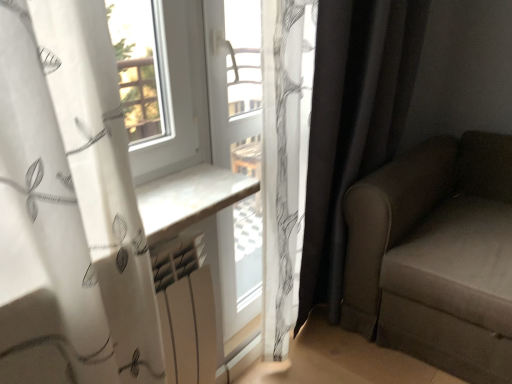
Find the location of a particular element. This screenshot has height=384, width=512. black fabric curtain at right is located at coordinates (352, 124).

In order to face white matte radiator at center, should I rotate leftwards or rightwards?

Rotate left and turn 10.207 degrees.

This screenshot has height=384, width=512. In order to click on suede-like brown couch at right in this screenshot , I will do `click(436, 256)`.

What do you see at coordinates (234, 83) in the screenshot?
I see `white plastic window frame at center` at bounding box center [234, 83].

The image size is (512, 384). In order to click on black fabric curtain at right in this screenshot , I will do `click(352, 124)`.

Consider the image. What's the angular difference between white plastic window frame at center and suede-like brown couch at right's facing directions?

The angular difference between white plastic window frame at center and suede-like brown couch at right is 90.3 degrees.

Who is bigger, white plastic window frame at center or suede-like brown couch at right?

suede-like brown couch at right is bigger.

Is white plastic window frame at center facing towards suede-like brown couch at right?

Yes, white plastic window frame at center is aimed at suede-like brown couch at right.

Is suede-like brown couch at right positioned before black fabric curtain at right?

Yes, suede-like brown couch at right is closer to the viewer.

From a real-world perspective, is suede-like brown couch at right positioned under black fabric curtain at right based on gravity?

Yes.

Who is smaller, suede-like brown couch at right or black fabric curtain at right?

With smaller size is black fabric curtain at right.

Which of these two, suede-like brown couch at right or black fabric curtain at right, is thinner?

Thinner between the two is black fabric curtain at right.

Can you confirm if white matte radiator at center is thinner than black fabric curtain at right?

Indeed, white matte radiator at center has a lesser width compared to black fabric curtain at right.

What are the coordinates of `radiator in front of the black fabric curtain at right` in the screenshot? It's located at (186, 309).

Does point (167, 278) come closer to viewer compared to point (400, 16)?

That is True.

From a real-world perspective, does white matte radiator at center sit lower than black fabric curtain at right?

Correct, in the physical world, white matte radiator at center is lower than black fabric curtain at right.

From the image's perspective, is suede-like brown couch at right located beneath white matte radiator at center?

Actually, suede-like brown couch at right appears above white matte radiator at center in the image.

This screenshot has width=512, height=384. What are the coordinates of `studio couch that appears on the right of white matte radiator at center` in the screenshot? It's located at (436, 256).

Does suede-like brown couch at right have a lesser height compared to white matte radiator at center?

A: Incorrect, the height of suede-like brown couch at right does not fall short of that of white matte radiator at center.

Is suede-like brown couch at right looking in the opposite direction of white matte radiator at center?

That's not correct — suede-like brown couch at right is not looking away from white matte radiator at center.

Is suede-like brown couch at right facing towards white plastic window frame at center?

No, suede-like brown couch at right is not turned towards white plastic window frame at center.

In the image, there is a suede-like brown couch at right. Identify the location of window frame above it (from the image's perspective). The width and height of the screenshot is (512, 384). (234, 83).

Considering the relative sizes of suede-like brown couch at right and white plastic window frame at center in the image provided, is suede-like brown couch at right smaller than white plastic window frame at center?

No, suede-like brown couch at right is not smaller than white plastic window frame at center.

Who is more distant, suede-like brown couch at right or white plastic window frame at center?

white plastic window frame at center is further away from the camera.

Which is nearer, (x=180, y=306) or (x=504, y=202)?

Point (x=180, y=306).

How different are the orientations of white matte radiator at center and suede-like brown couch at right in degrees?

The angular difference between white matte radiator at center and suede-like brown couch at right is 88 degrees.

Is white matte radiator at center wider or thinner than suede-like brown couch at right?

white matte radiator at center is thinner than suede-like brown couch at right.

Considering the positions of objects white matte radiator at center and suede-like brown couch at right in the image provided, who is more to the left, white matte radiator at center or suede-like brown couch at right?

white matte radiator at center.

Which object is further away from the camera, black fabric curtain at right or suede-like brown couch at right?

black fabric curtain at right.

Which is closer, (317,140) or (412,292)?

Clearly, point (317,140) is closer to the camera than point (412,292).

Is the surface of black fabric curtain at right in direct contact with suede-like brown couch at right?

There is a gap between black fabric curtain at right and suede-like brown couch at right.

Which is more to the right, black fabric curtain at right or suede-like brown couch at right?

Positioned to the right is suede-like brown couch at right.

You are a GUI agent. You are given a task and a screenshot of the screen. Output one action in this format:
    pyautogui.click(x=<x>, y=<y>)
    Task: Click on the studio couch beneath the white plastic window frame at center (from a real-world perspective)
    
    Given the screenshot: What is the action you would take?
    pyautogui.click(x=436, y=256)

Locate an element on the screen. This screenshot has height=384, width=512. curtain located on the left of suede-like brown couch at right is located at coordinates (352, 124).

Looking at the image, which one is located closer to suede-like brown couch at right, white plastic window frame at center or black fabric curtain at right?

black fabric curtain at right.

From the image, which object appears to be nearer to white matte radiator at center, black fabric curtain at right or white plastic window frame at center?

white plastic window frame at center is closer to white matte radiator at center.

Based on their spatial positions, is suede-like brown couch at right or white plastic window frame at center further from black fabric curtain at right?

Among the two, white plastic window frame at center is located further to black fabric curtain at right.

Estimate the real-world distances between objects in this image. Which object is closer to white matte radiator at center, suede-like brown couch at right or black fabric curtain at right?

black fabric curtain at right is closer to white matte radiator at center.

When comparing their distances from white plastic window frame at center, does suede-like brown couch at right or white matte radiator at center seem further?

suede-like brown couch at right lies further to white plastic window frame at center than the other object.

When comparing their distances from black fabric curtain at right, does white plastic window frame at center or white matte radiator at center seem closer?

white plastic window frame at center is closer to black fabric curtain at right.

When comparing their distances from black fabric curtain at right, does suede-like brown couch at right or white matte radiator at center seem further?

Among the two, white matte radiator at center is located further to black fabric curtain at right.

Estimate the real-world distances between objects in this image. Which object is closer to white matte radiator at center, black fabric curtain at right or suede-like brown couch at right?

black fabric curtain at right is positioned closer to the anchor white matte radiator at center.

Locate an element on the screen. The width and height of the screenshot is (512, 384). curtain between white plastic window frame at center and suede-like brown couch at right from left to right is located at coordinates (352, 124).

The width and height of the screenshot is (512, 384). I want to click on window frame between white matte radiator at center and suede-like brown couch at right in the horizontal direction, so 234,83.

The image size is (512, 384). I want to click on curtain between white matte radiator at center and suede-like brown couch at right in the horizontal direction, so click(352, 124).

I want to click on window frame between white matte radiator at center and black fabric curtain at right from left to right, so click(234, 83).